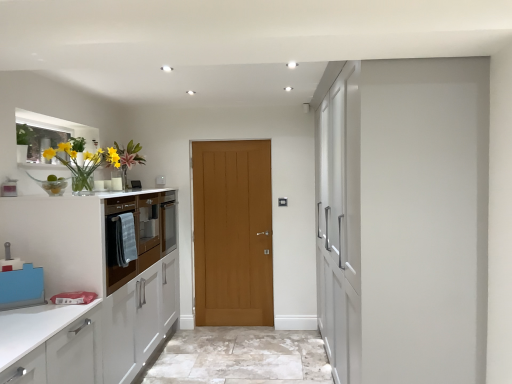
Question: Should I look upward or downward to see white glossy cabinetry at left, acting as the 2th cabinetry starting from the back?

Choices:
 (A) up
 (B) down

Answer: (B)

Question: Can wooden door at center be found inside white glossy cabinetry at left, the 1th cabinetry from the front?

Choices:
 (A) no
 (B) yes

Answer: (A)

Question: Considering the relative positions of white glossy cabinetry at left, the 1th cabinetry from the front, and wooden door at center in the image provided, is white glossy cabinetry at left, the 1th cabinetry from the front, to the left of wooden door at center from the viewer's perspective?

Choices:
 (A) yes
 (B) no

Answer: (A)

Question: Is white glossy cabinetry at left, the 1th cabinetry from the front, shorter than wooden door at center?

Choices:
 (A) no
 (B) yes

Answer: (B)

Question: Is white glossy cabinetry at left, acting as the 2th cabinetry starting from the back, directly adjacent to wooden door at center?

Choices:
 (A) no
 (B) yes

Answer: (A)

Question: Is white glossy cabinetry at left, acting as the 2th cabinetry starting from the back, not near wooden door at center?

Choices:
 (A) no
 (B) yes

Answer: (B)

Question: Is white glossy cabinetry at left, the 1th cabinetry from the front, facing away from wooden door at center?

Choices:
 (A) no
 (B) yes

Answer: (A)

Question: Considering the relative sizes of matte wood cabinet at left, the second cabinetry in the front-to-back sequence, and wooden door at center in the image provided, is matte wood cabinet at left, the second cabinetry in the front-to-back sequence, shorter than wooden door at center?

Choices:
 (A) yes
 (B) no

Answer: (A)

Question: Can we say matte wood cabinet at left, which is the 1th cabinetry in back-to-front order, lies outside wooden door at center?

Choices:
 (A) yes
 (B) no

Answer: (A)

Question: Could you tell me if matte wood cabinet at left, the second cabinetry in the front-to-back sequence, is turned towards wooden door at center?

Choices:
 (A) no
 (B) yes

Answer: (B)

Question: Is matte wood cabinet at left, the second cabinetry in the front-to-back sequence, positioned in front of wooden door at center?

Choices:
 (A) yes
 (B) no

Answer: (A)

Question: Is wooden door at center surrounded by matte wood cabinet at left, the second cabinetry in the front-to-back sequence?

Choices:
 (A) no
 (B) yes

Answer: (A)

Question: From the image's perspective, is matte wood cabinet at left, which is the 1th cabinetry in back-to-front order, below wooden door at center?

Choices:
 (A) yes
 (B) no

Answer: (B)

Question: Considering the relative positions of wooden door at center and matte wood cabinet at left, which is the 1th cabinetry in back-to-front order, in the image provided, is wooden door at center behind matte wood cabinet at left, which is the 1th cabinetry in back-to-front order,?

Choices:
 (A) no
 (B) yes

Answer: (B)